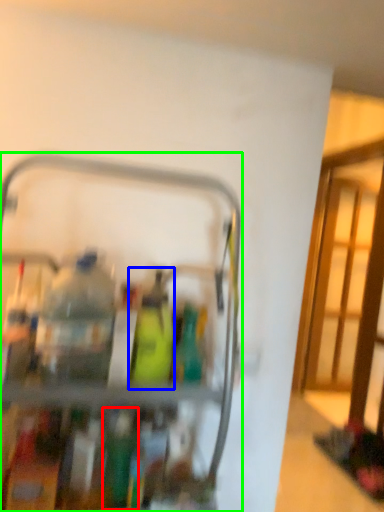
Question: Which object is positioned farthest from bottle (highlighted by a red box)? Select from bottle (highlighted by a blue box) and appliance (highlighted by a green box).

Choices:
 (A) bottle
 (B) appliance

Answer: (B)